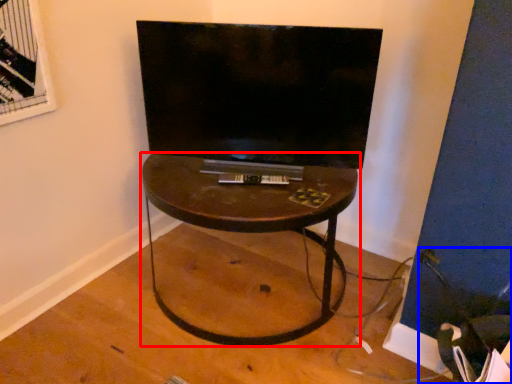
Question: Which object appears closest to the camera in this image, table (highlighted by a red box) or swivel chair (highlighted by a blue box)?

Choices:
 (A) table
 (B) swivel chair

Answer: (B)